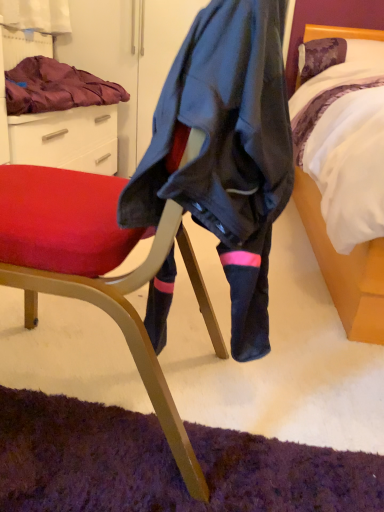
What do you see at coordinates (56, 87) in the screenshot? I see `velvet purple blanket at upper left` at bounding box center [56, 87].

What do you see at coordinates (114, 296) in the screenshot?
I see `matte black chair at center` at bounding box center [114, 296].

What do you see at coordinates (345, 269) in the screenshot?
I see `white satin bed at right` at bounding box center [345, 269].

I want to click on velvet purple blanket at upper left, so click(x=56, y=87).

Which object is positioned more to the left, matte black chair at center or velvet purple blanket at upper left?

Positioned to the left is velvet purple blanket at upper left.

Are matte black chair at center and velvet purple blanket at upper left beside each other?

matte black chair at center and velvet purple blanket at upper left are clearly separated.

Considering the positions of objects matte black chair at center and velvet purple blanket at upper left in the image provided, who is behind, matte black chair at center or velvet purple blanket at upper left?

velvet purple blanket at upper left is behind.

From the picture: Would you say velvet purple blanket at upper left is inside or outside white satin bed at right?

velvet purple blanket at upper left lies outside white satin bed at right.

Is velvet purple blanket at upper left next to white satin bed at right and touching it?

No.

From the image's perspective, does velvet purple blanket at upper left appear higher than white satin bed at right?

Yes, from the image's perspective, velvet purple blanket at upper left is above white satin bed at right.

Which point is more distant from viewer, (35, 106) or (370, 302)?

The point (35, 106) is more distant.

Is white satin bed at right completely or partially outside of velvet purple blanket at upper left?

Yes, white satin bed at right is located beyond the bounds of velvet purple blanket at upper left.

Does white satin bed at right have a lesser width compared to velvet purple blanket at upper left?

No.

From the image's perspective, would you say white satin bed at right is shown under velvet purple blanket at upper left?

Yes, from the image's perspective, white satin bed at right is below velvet purple blanket at upper left.

Can we say white satin bed at right lies outside matte black chair at center?

Indeed, white satin bed at right is completely outside matte black chair at center.

Where is `bed above the matte black chair at center (from a real-world perspective)`? Image resolution: width=384 pixels, height=512 pixels. bed above the matte black chair at center (from a real-world perspective) is located at coordinates (345, 269).

From a real-world perspective, does white satin bed at right stand above matte black chair at center?

Yes.

Between matte black chair at center and white satin bed at right, which one has smaller size?

With smaller size is matte black chair at center.

Does point (154, 381) come farther from viewer compared to point (370, 295)?

No, it is not.

Is matte black chair at center next to white satin bed at right and touching it?

No, matte black chair at center is not with white satin bed at right.

This screenshot has width=384, height=512. Find the location of `chair lying on the left of white satin bed at right`. chair lying on the left of white satin bed at right is located at coordinates (114, 296).

Is velvet purple blanket at upper left oriented away from matte black chair at center?

velvet purple blanket at upper left does not have its back to matte black chair at center.

Would you consider velvet purple blanket at upper left to be distant from matte black chair at center?

That's not correct — velvet purple blanket at upper left is a little close to matte black chair at center.

How many degrees apart are the facing directions of velvet purple blanket at upper left and matte black chair at center?

The angular difference between velvet purple blanket at upper left and matte black chair at center is 178 degrees.

Which of these two, velvet purple blanket at upper left or matte black chair at center, stands shorter?

velvet purple blanket at upper left.

Find the location of a particular element. This screenshot has height=512, width=384. blanket above the matte black chair at center (from the image's perspective) is located at coordinates pyautogui.click(x=56, y=87).

Locate an element on the screen. The height and width of the screenshot is (512, 384). bed below the velvet purple blanket at upper left (from a real-world perspective) is located at coordinates (345, 269).

Which object lies nearer to the anchor point velvet purple blanket at upper left, white satin bed at right or matte black chair at center?

Based on the image, matte black chair at center appears to be nearer to velvet purple blanket at upper left.

When comparing their distances from matte black chair at center, does white satin bed at right or velvet purple blanket at upper left seem closer?

white satin bed at right is closer to matte black chair at center.

Looking at the image, which one is located closer to white satin bed at right, matte black chair at center or velvet purple blanket at upper left?

Among the two, matte black chair at center is located nearer to white satin bed at right.

When comparing their distances from velvet purple blanket at upper left, does matte black chair at center or white satin bed at right seem further?

The object further to velvet purple blanket at upper left is white satin bed at right.

Estimate the real-world distances between objects in this image. Which object is closer to white satin bed at right, velvet purple blanket at upper left or matte black chair at center?

matte black chair at center lies closer to white satin bed at right than the other object.

When comparing their distances from matte black chair at center, does velvet purple blanket at upper left or white satin bed at right seem closer?

white satin bed at right lies closer to matte black chair at center than the other object.

The image size is (384, 512). I want to click on chair between velvet purple blanket at upper left and white satin bed at right in the horizontal direction, so click(114, 296).